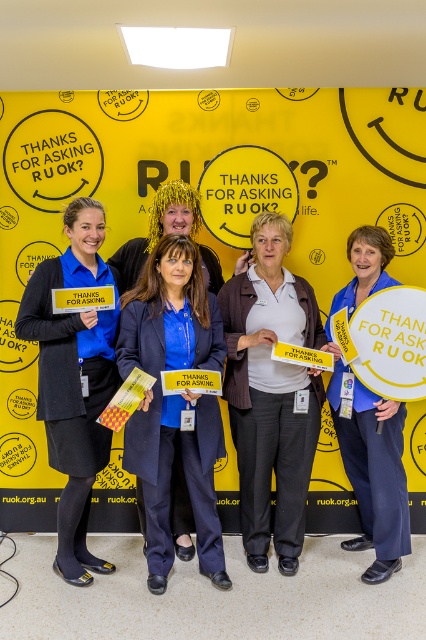
This screenshot has height=640, width=426. What do you see at coordinates (270, 392) in the screenshot?
I see `white cotton shirt at center` at bounding box center [270, 392].

Does point (319, 392) come behind point (115, 346)?

Yes.

Identify the location of white cotton shirt at center. (270, 392).

Does yellow paper sign at center have a smaller size compared to blue fabric sign at center?

Incorrect, yellow paper sign at center is not smaller in size than blue fabric sign at center.

Which is above, yellow paper sign at center or blue fabric sign at center?

Positioned higher is yellow paper sign at center.

Which is behind, point (301, 168) or point (357, 435)?

Positioned behind is point (301, 168).

Locate an element on the screen. The image size is (426, 640). yellow paper sign at center is located at coordinates (201, 204).

Can you confirm if white cotton shirt at center is smaller than matte blue uniform at left?

Correct, white cotton shirt at center occupies less space than matte blue uniform at left.

At what (x,y) coordinates should I click in order to perform the action: click on white cotton shirt at center. Please return your answer as a coordinate pair (x, y). Looking at the image, I should click on (270, 392).

Locate an element on the screen. This screenshot has width=426, height=640. white cotton shirt at center is located at coordinates (270, 392).